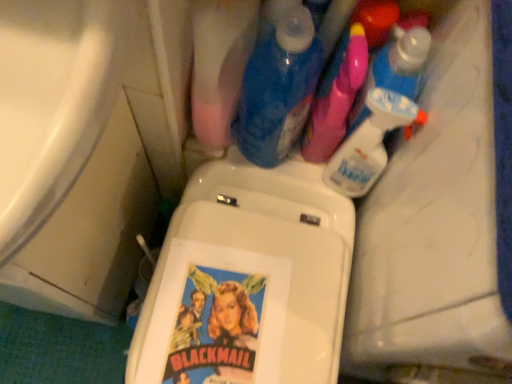
Question: From a real-world perspective, is translucent plastic spray bottle at upper right, which ranks as the fourth cleaning product in left-to-right order, over pink plastic spray bottle at upper right, which is the 2th cleaning product in left-to-right order?

Choices:
 (A) no
 (B) yes

Answer: (B)

Question: Is translucent plastic spray bottle at upper right, positioned as the 1th cleaning product in right-to-left order, in front of pink plastic spray bottle at upper right, which is the 2th cleaning product in left-to-right order?

Choices:
 (A) no
 (B) yes

Answer: (A)

Question: From a real-world perspective, is translucent plastic spray bottle at upper right, which ranks as the fourth cleaning product in left-to-right order, located beneath pink plastic spray bottle at upper right, the third cleaning product viewed from the right?

Choices:
 (A) no
 (B) yes

Answer: (A)

Question: Does translucent plastic spray bottle at upper right, positioned as the 1th cleaning product in right-to-left order, have a lesser height compared to pink plastic spray bottle at upper right, the third cleaning product viewed from the right?

Choices:
 (A) yes
 (B) no

Answer: (B)

Question: Does translucent plastic spray bottle at upper right, positioned as the 1th cleaning product in right-to-left order, have a greater height compared to pink plastic spray bottle at upper right, which is the 2th cleaning product in left-to-right order?

Choices:
 (A) yes
 (B) no

Answer: (B)

Question: Is blue glossy bottle at upper center, acting as the 4th cleaning product starting from the right, in front of or behind translucent plastic spray bottle at upper right, positioned as the 1th cleaning product in right-to-left order, in the image?

Choices:
 (A) front
 (B) behind

Answer: (A)

Question: Is blue glossy bottle at upper center, acting as the 4th cleaning product starting from the right, wider or thinner than translucent plastic spray bottle at upper right, positioned as the 1th cleaning product in right-to-left order?

Choices:
 (A) thin
 (B) wide

Answer: (B)

Question: Considering the positions of point [281, 33] and point [353, 117], is point [281, 33] closer or farther from the camera than point [353, 117]?

Choices:
 (A) closer
 (B) farther

Answer: (A)

Question: Which is correct: blue glossy bottle at upper center, the first cleaning product positioned from the left, is inside translucent plastic spray bottle at upper right, positioned as the 1th cleaning product in right-to-left order, or outside of it?

Choices:
 (A) inside
 (B) outside

Answer: (B)

Question: Does point (247, 102) appear closer or farther from the camera than point (46, 114)?

Choices:
 (A) farther
 (B) closer

Answer: (A)

Question: Do you think blue glossy bottle at upper center, acting as the 4th cleaning product starting from the right, is within white glossy bathtub at lower left, or outside of it?

Choices:
 (A) inside
 (B) outside

Answer: (B)

Question: In the image, is blue glossy bottle at upper center, acting as the 4th cleaning product starting from the right, positioned in front of or behind white glossy bathtub at lower left?

Choices:
 (A) front
 (B) behind

Answer: (B)

Question: Is blue glossy bottle at upper center, acting as the 4th cleaning product starting from the right, wider or thinner than white glossy bathtub at lower left?

Choices:
 (A) wide
 (B) thin

Answer: (B)

Question: Is white glossy bathtub at lower left in front of or behind blue glossy bottle at upper center, acting as the 4th cleaning product starting from the right, in the image?

Choices:
 (A) front
 (B) behind

Answer: (A)

Question: In terms of width, does white glossy bathtub at lower left look wider or thinner when compared to blue glossy bottle at upper center, acting as the 4th cleaning product starting from the right?

Choices:
 (A) thin
 (B) wide

Answer: (B)